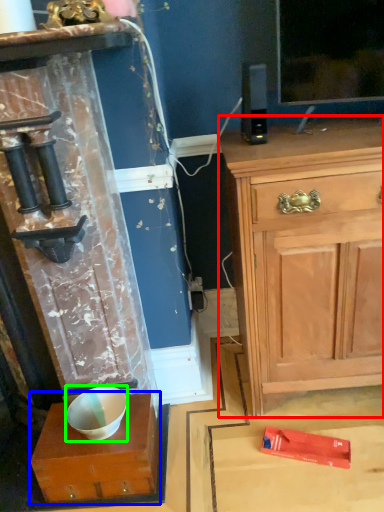
Question: Estimate the real-world distances between objects in this image. Which object is farther from chest of drawers (highlighted by a red box), cabinetry (highlighted by a blue box) or bowl (highlighted by a green box)?

Choices:
 (A) cabinetry
 (B) bowl

Answer: (B)